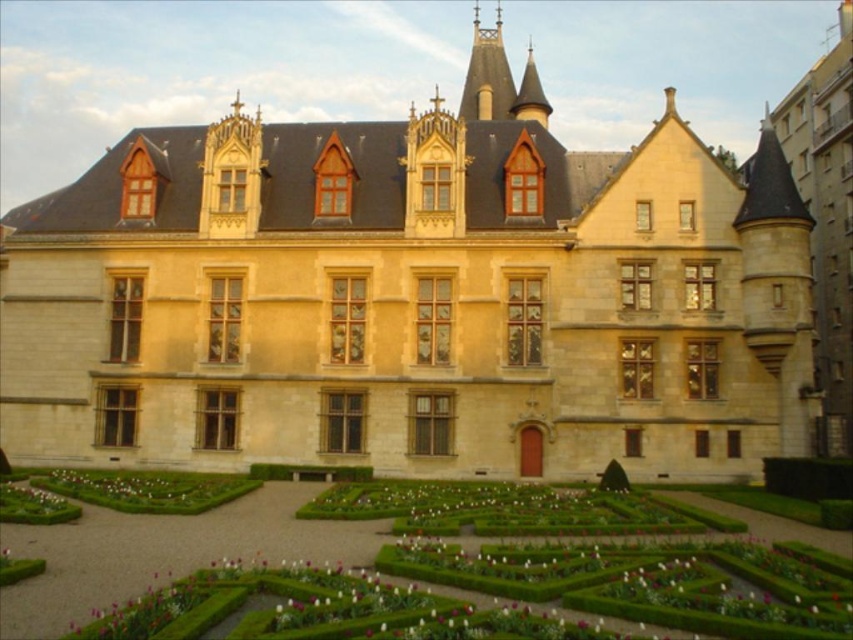
Does point (73, 221) come closer to viewer compared to point (142, 580)?

No, it is not.

Is beige stone palace at center bigger than green hedge maze at lower center?

Correct, beige stone palace at center is larger in size than green hedge maze at lower center.

Locate an element on the screen. beige stone palace at center is located at coordinates (413, 298).

Who is lower down, green hedge maze at lower center or green leafy hedge at lower right?

green hedge maze at lower center is lower down.

Is green hedge maze at lower center to the right of green leafy hedge at lower right from the viewer's perspective?

Incorrect, green hedge maze at lower center is not on the right side of green leafy hedge at lower right.

The image size is (853, 640). What do you see at coordinates (164, 552) in the screenshot?
I see `green hedge maze at lower center` at bounding box center [164, 552].

Identify the location of green hedge maze at lower center. This screenshot has height=640, width=853. (164, 552).

Which is above, green hedge maze at lower center or green leafy hedge at center?

green leafy hedge at center is above.

Is green hedge maze at lower center to the left of green leafy hedge at center from the viewer's perspective?

In fact, green hedge maze at lower center is to the right of green leafy hedge at center.

The width and height of the screenshot is (853, 640). I want to click on green hedge maze at lower center, so click(x=164, y=552).